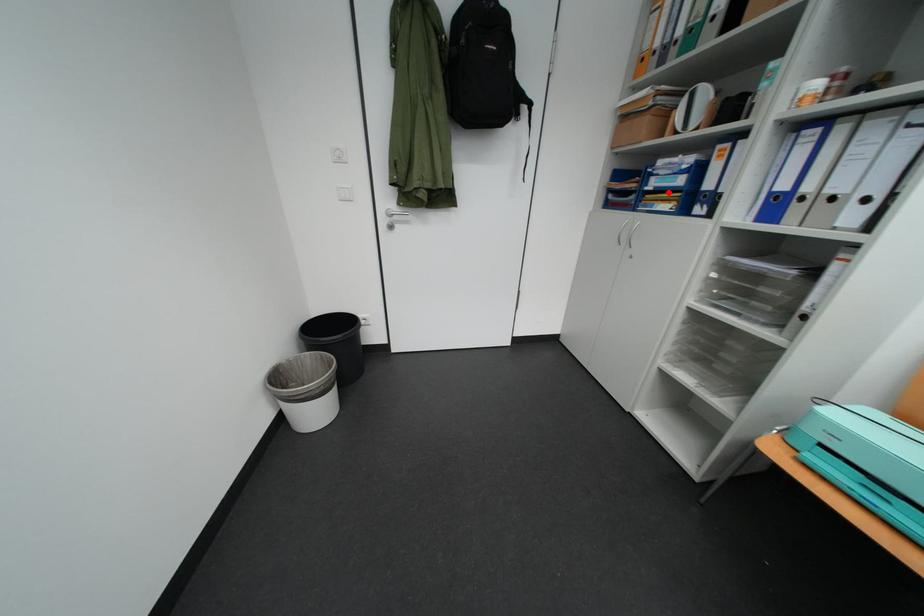
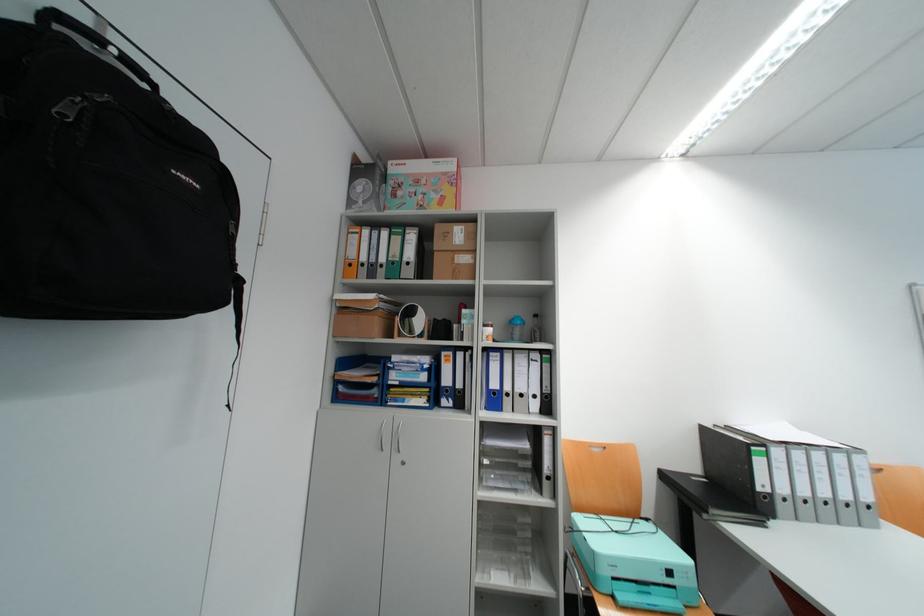
Locate, in the second image, the point that corresponds to the highlighted location in the first image.

(415, 387)